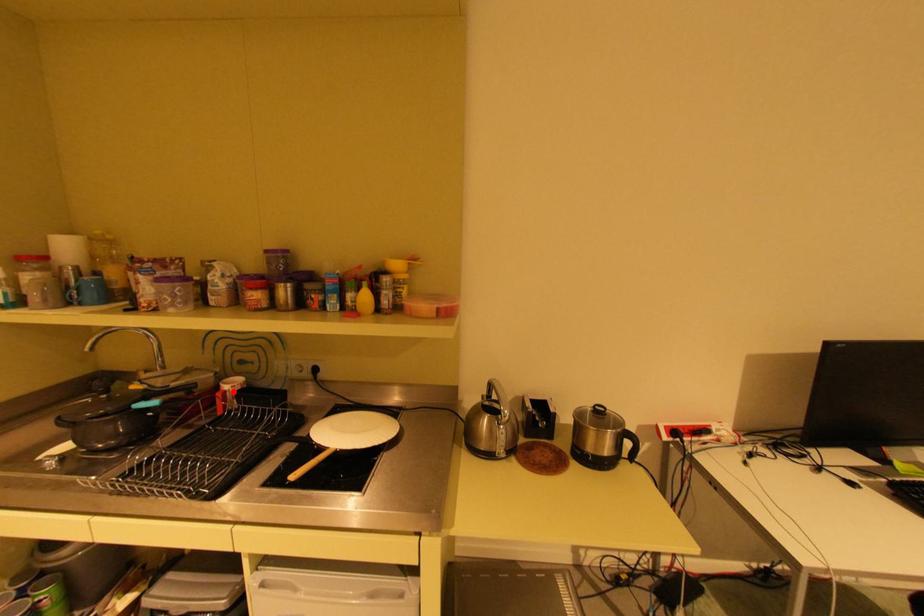
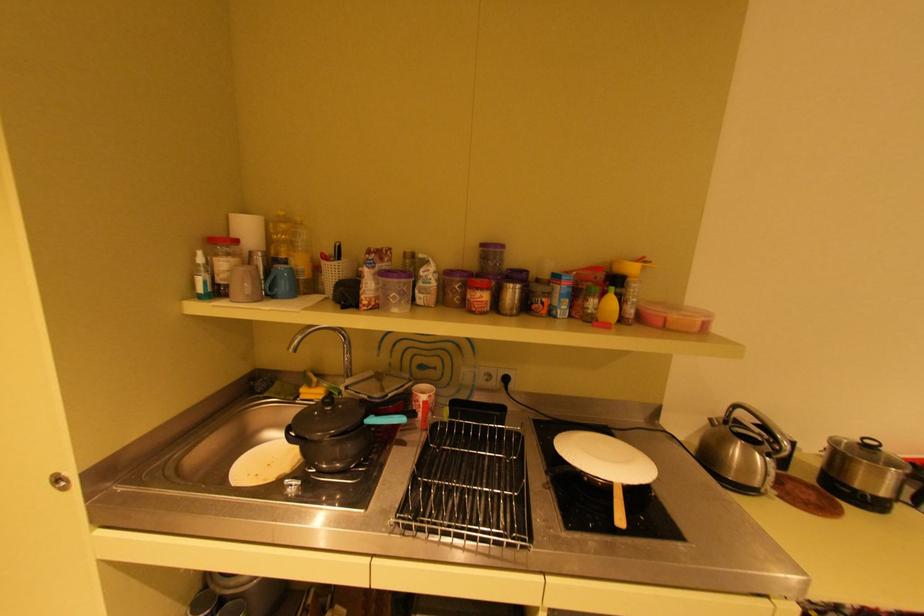
The point at the highlighted location is marked in the first image. Where is the corresponding point in the second image?

(432, 402)